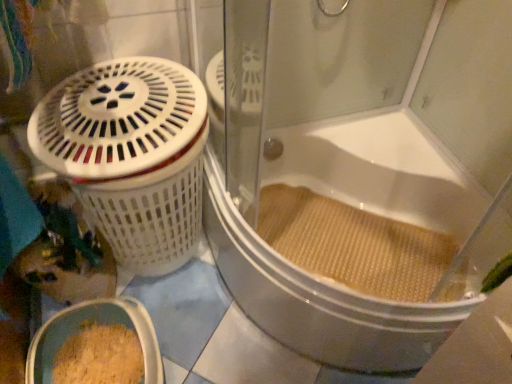
Identify the location of free point above beige textured mat at lower right (from a real-world perspective). (332, 231).